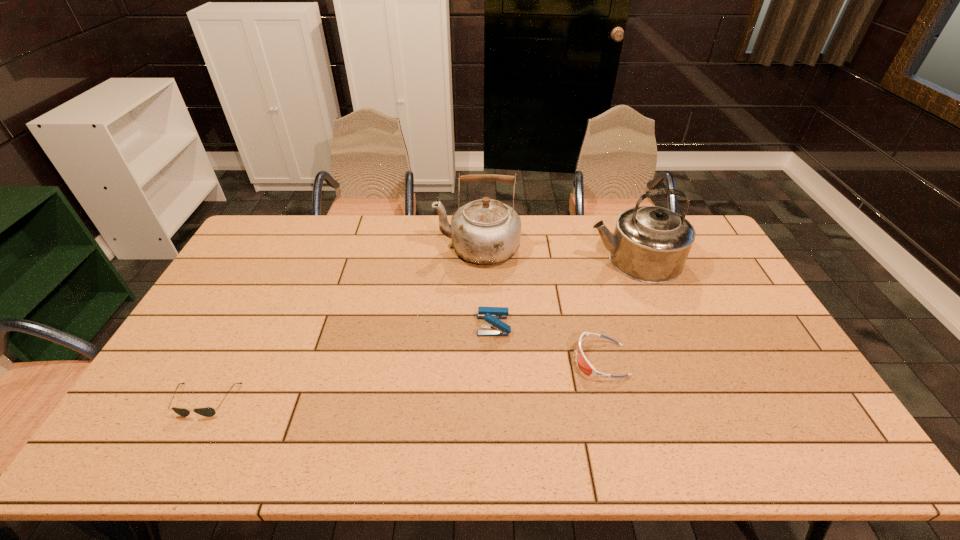
At what (x,y) coordinates should I click in order to perform the action: click on vacant region between the leftmost object and the third tallest object. Please return your answer as a coordinate pair (x, y). The height and width of the screenshot is (540, 960). Looking at the image, I should click on (349, 363).

Locate an element on the screen. This screenshot has width=960, height=540. free spot between the right kettle and the goggles is located at coordinates coord(617,310).

At what (x,y) coordinates should I click in order to perform the action: click on free space between the right kettle and the left kettle. Please return your answer as a coordinate pair (x, y). The height and width of the screenshot is (540, 960). Looking at the image, I should click on click(556, 254).

Where is `free point between the left kettle and the right kettle`? The width and height of the screenshot is (960, 540). free point between the left kettle and the right kettle is located at coordinates (556, 254).

I want to click on vacant area between the left kettle and the right kettle, so click(556, 254).

Where is `free space between the second nearest object and the nearest object`? This screenshot has height=540, width=960. free space between the second nearest object and the nearest object is located at coordinates (403, 380).

Where is `vacant area between the goggles and the right kettle`? vacant area between the goggles and the right kettle is located at coordinates (617, 310).

The height and width of the screenshot is (540, 960). I want to click on object that is the fourth nearest to the goggles, so click(x=207, y=412).

At what (x,y) coordinates should I click in order to perform the action: click on object that is the nearest to the third shortest object. Please return your answer as a coordinate pair (x, y). The width and height of the screenshot is (960, 540). Looking at the image, I should click on (585, 366).

Where is `vacant space that satisfies the following two spatial constraints: 1. on the front-facing side of the fourth tallest object; 2. on the lenses of the shortest object`? Image resolution: width=960 pixels, height=540 pixels. vacant space that satisfies the following two spatial constraints: 1. on the front-facing side of the fourth tallest object; 2. on the lenses of the shortest object is located at coordinates (611, 401).